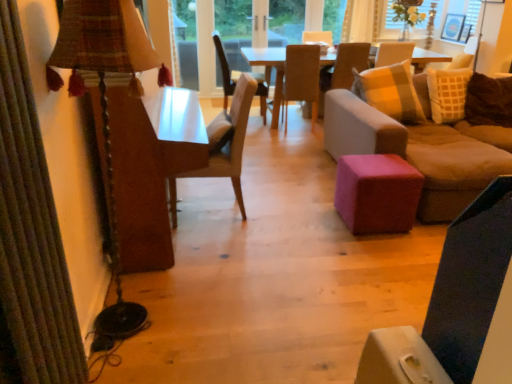
The height and width of the screenshot is (384, 512). I want to click on vacant space in between textured fabric lampshade at left and pink fabric ottoman at center, so click(x=280, y=254).